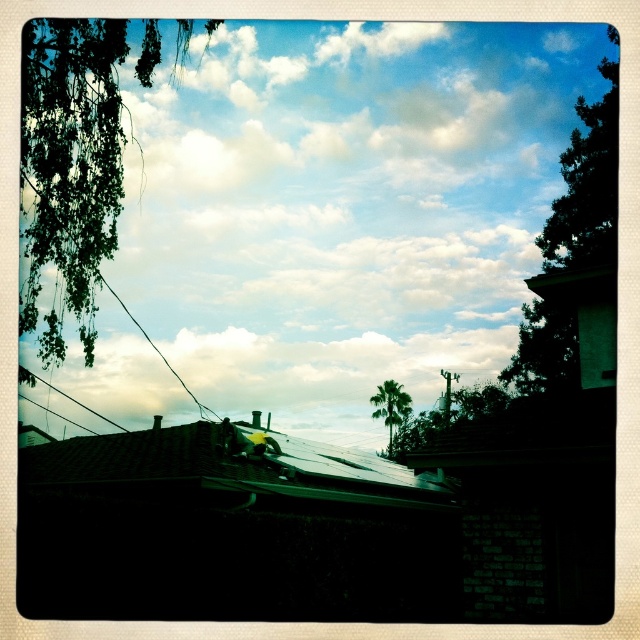
From the picture: You are standing on the ground looking at the green tile roof at lower left and the white fluffy cloud at upper center. How far apart are these two objects from your perspective?

The white fluffy cloud at upper center is 249.16 feet away from the green tile roof at lower left.

You are an architect designing a new solar panel layout for the house. You notice the white fluffy cloud at upper center and the green tile roof at lower left in the scene. Which object has a greater width?

The white fluffy cloud at upper center has a greater width than the green tile roof at lower left according to the description.